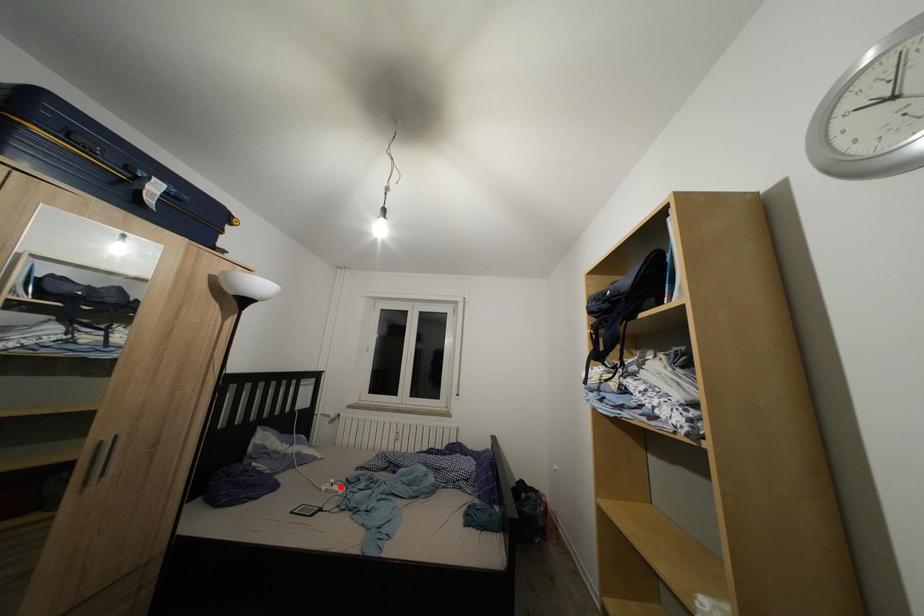
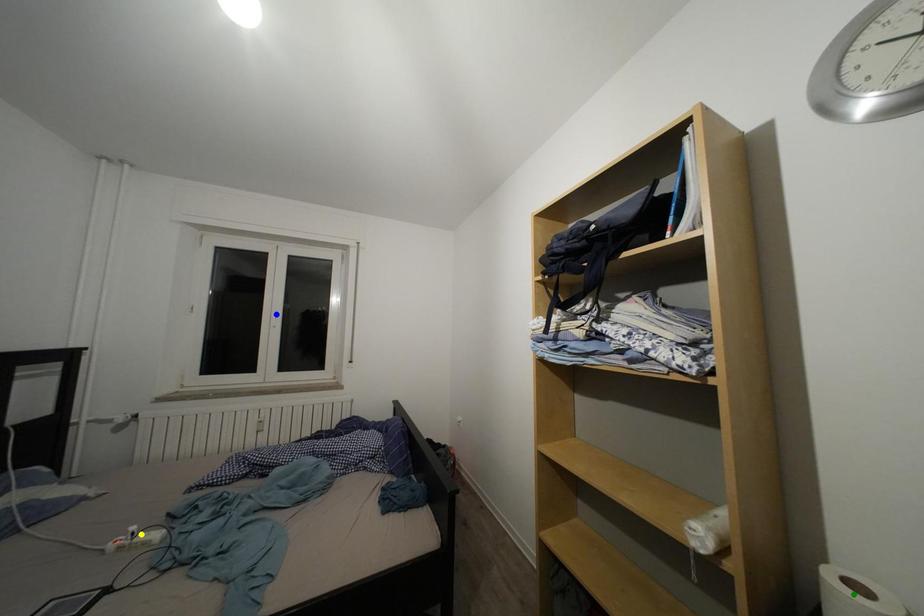
Question: I am providing you with two images of the same scene from different viewpoints. A red point is marked on the first image. You are given multiple points on the second image. Can you choose the point in image 2 that corresponds to the point in image 1?

Choices:
 (A) yellow point
 (B) blue point
 (C) green point

Answer: (A)